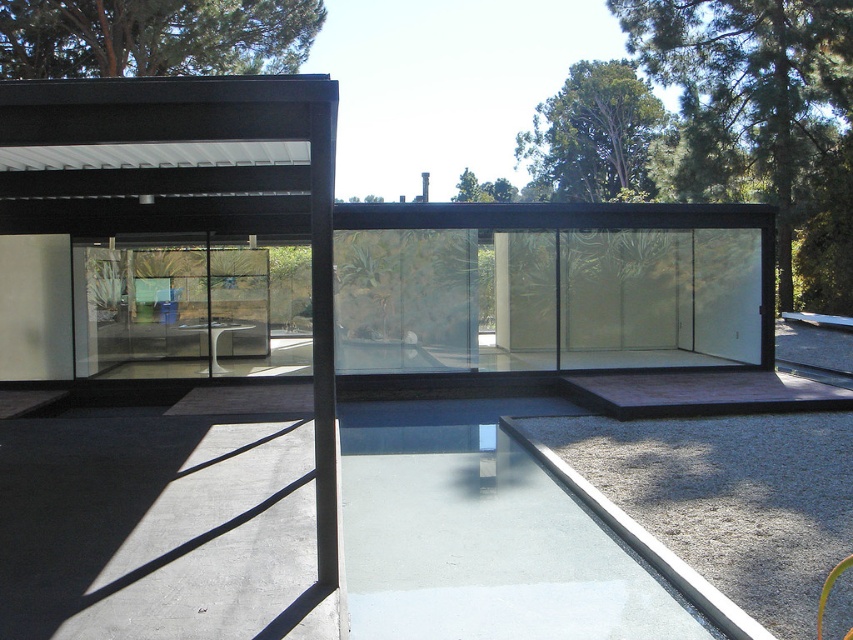
You are standing in front of the modern architectural structure and want to determine the position of two points marked in the image. Which of the two points, point (372,467) or point (204,352), is closer to you?

Point (372,467) is closer to the viewer than point (204,352).

You are standing in front of the modern building and want to take a photo of both the frosted glass wall at center and the transparent glass pool at center. Which one should you position to the left side of your camera frame to capture both in the shot?

To capture both the frosted glass wall at center and the transparent glass pool at center in your photo, position the transparent glass pool at center on the left side of your camera frame since the frosted glass wall at center is to the right of it.